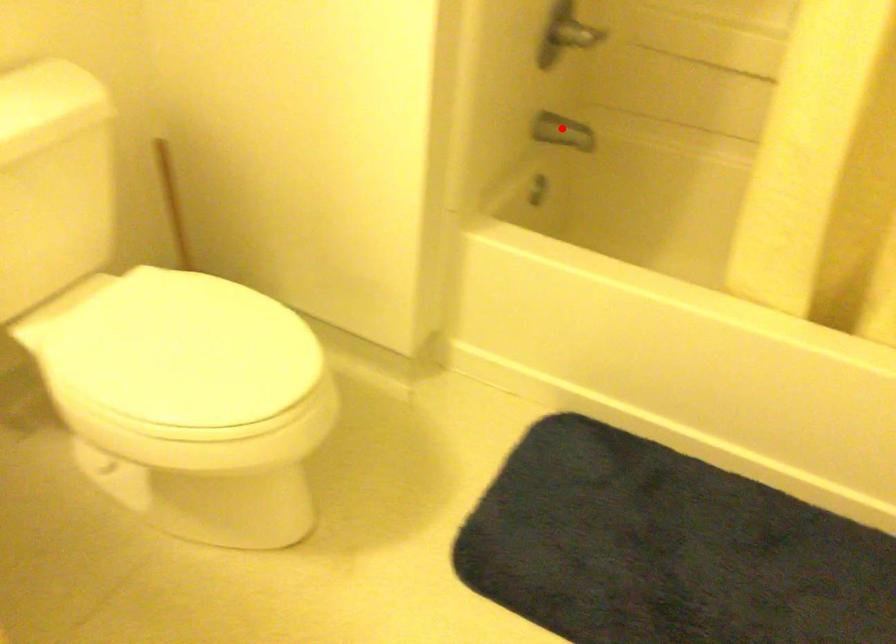
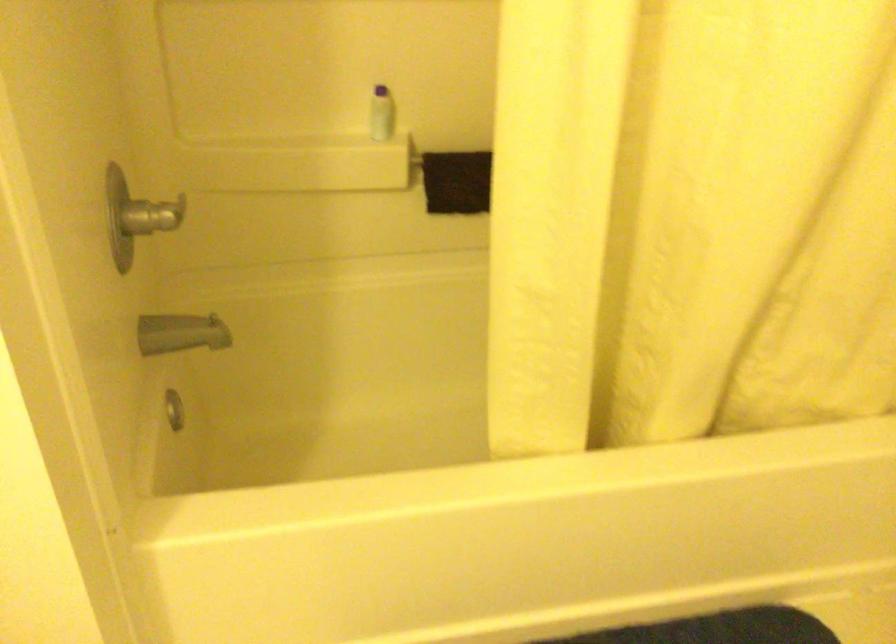
Locate, in the second image, the point that corresponds to the highlighted location in the first image.

(181, 333)